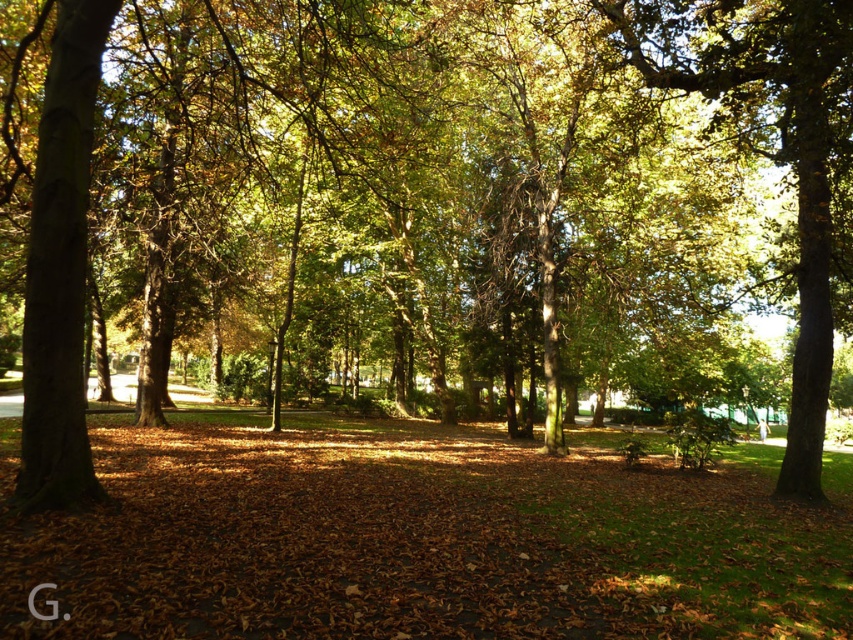
Question: Which point is farther to the camera?

Choices:
 (A) (726, 576)
 (B) (675, 48)

Answer: (B)

Question: Can you confirm if brown leaf litter at center is wider than green leafy tree at center?

Choices:
 (A) no
 (B) yes

Answer: (B)

Question: Is brown leaf litter at center to the right of green leafy tree at center from the viewer's perspective?

Choices:
 (A) yes
 (B) no

Answer: (B)

Question: Does brown leaf litter at center lie in front of green leafy tree at center?

Choices:
 (A) yes
 (B) no

Answer: (A)